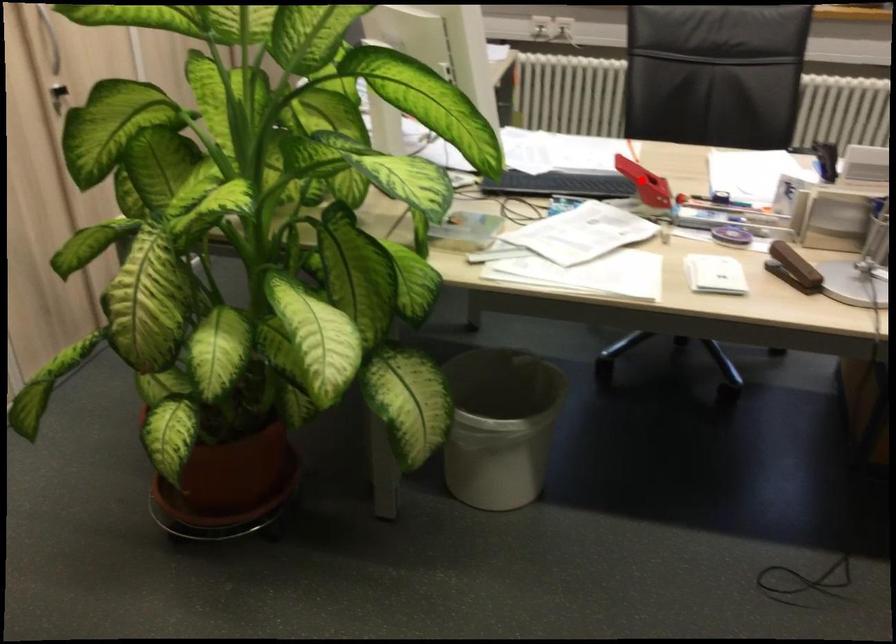
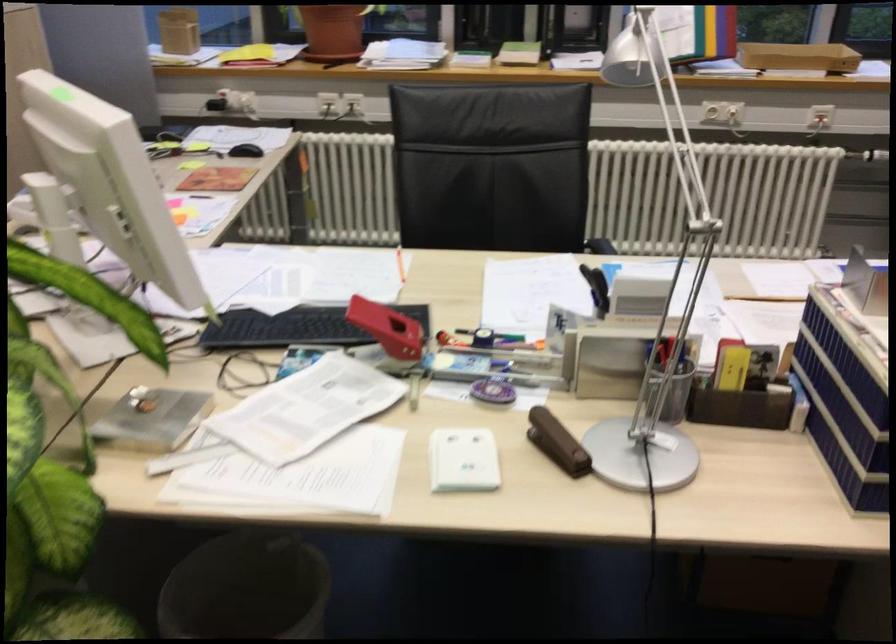
Question: I am providing you with two images of the same scene from different viewpoints. A red point is shown in image1. For the corresponding object point in image2, is it positioned nearer or farther from the camera?

Choices:
 (A) Nearer
 (B) Farther

Answer: (A)